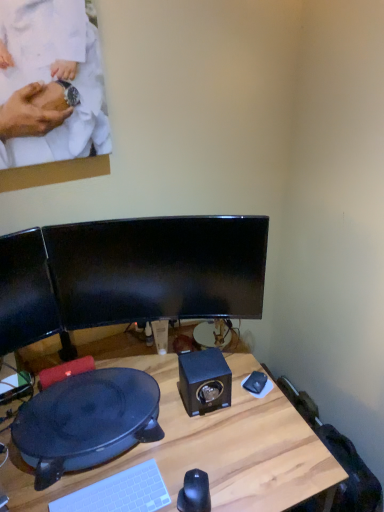
This screenshot has width=384, height=512. What do you see at coordinates (194, 492) in the screenshot? I see `black glossy mouse at lower center` at bounding box center [194, 492].

The width and height of the screenshot is (384, 512). What do you see at coordinates (206, 448) in the screenshot?
I see `wooden desk at center` at bounding box center [206, 448].

At what (x,y) coordinates should I click in order to perform the action: click on black glossy mouse at lower center. Please return your answer as a coordinate pair (x, y). Image resolution: width=384 pixels, height=512 pixels. Looking at the image, I should click on (194, 492).

In the scene shown: From the image's perspective, is black glossy mouse at lower center below white plastic keyboard at lower center?

Actually, black glossy mouse at lower center appears above white plastic keyboard at lower center in the image.

Locate an element on the screen. The width and height of the screenshot is (384, 512). mouse located behind the white plastic keyboard at lower center is located at coordinates (194, 492).

Is black glossy mouse at lower center outside of white plastic keyboard at lower center?

Yes.

Can you confirm if black glossy mouse at lower center is taller than black matte speaker at center?

No, black glossy mouse at lower center is not taller than black matte speaker at center.

How different are the orientations of black glossy mouse at lower center and black matte speaker at center in degrees?

They differ by 15.7 degrees in their facing directions.

Based on the photo, can you confirm if black glossy mouse at lower center is positioned to the left of black matte speaker at center?

Yes.

Locate an element on the screen. mouse located underneath the black matte speaker at center (from a real-world perspective) is located at coordinates (194, 492).

Does wooden desk at center have a lesser width compared to black glossy monitor at center?

In fact, wooden desk at center might be wider than black glossy monitor at center.

In the scene shown: Is wooden desk at center inside the boundaries of black glossy monitor at center, or outside?

wooden desk at center is not inside black glossy monitor at center, it's outside.

Is black matte speaker at center turned away from wooden desk at center?

black matte speaker at center does not have its back to wooden desk at center.

Which is correct: black matte speaker at center is inside wooden desk at center, or outside of it?

black matte speaker at center is outside wooden desk at center.

Find the location of `desk below the black matte speaker at center (from the image's perspective)`. desk below the black matte speaker at center (from the image's perspective) is located at coordinates (206, 448).

Looking at this image, is black glossy monitor at center oriented towards black glossy mouse at lower center?

No, black glossy monitor at center does not turn towards black glossy mouse at lower center.

Is black glossy monitor at center at the right side of black glossy mouse at lower center?

Incorrect, black glossy monitor at center is not on the right side of black glossy mouse at lower center.

Which of these two, black glossy monitor at center or black glossy mouse at lower center, stands taller?

black glossy monitor at center.

How many degrees apart are the facing directions of black glossy monitor at center and black glossy mouse at lower center?

The angular difference between black glossy monitor at center and black glossy mouse at lower center is 2.86 degrees.

Considering the sizes of objects black matte speaker at center and black glossy monitor at center in the image provided, who is smaller, black matte speaker at center or black glossy monitor at center?

black matte speaker at center.

Locate an element on the screen. speaker on the right of black glossy monitor at center is located at coordinates (204, 381).

Considering the points (193, 391) and (81, 247), which point is behind, point (193, 391) or point (81, 247)?

The point (193, 391) is farther.

From a real-world perspective, is black matte speaker at center physically located above or below black glossy monitor at center?

From a real-world perspective, black matte speaker at center is physically below black glossy monitor at center.

From a real-world perspective, who is located higher, wooden desk at center or white plastic keyboard at lower center?

From a 3D spatial view, white plastic keyboard at lower center is above.

From the image's perspective, is wooden desk at center located above or below white plastic keyboard at lower center?

Based on their image positions, wooden desk at center is located beneath white plastic keyboard at lower center.

Is wooden desk at center directly adjacent to white plastic keyboard at lower center?

No, wooden desk at center is not touching white plastic keyboard at lower center.

Considering the relative sizes of wooden desk at center and white plastic keyboard at lower center in the image provided, is wooden desk at center thinner than white plastic keyboard at lower center?

No.

The height and width of the screenshot is (512, 384). I want to click on mouse on the right of white plastic keyboard at lower center, so click(x=194, y=492).

Locate an element on the screen. The height and width of the screenshot is (512, 384). mouse below the black matte speaker at center (from the image's perspective) is located at coordinates (194, 492).

Consider the image. Looking at the image, which one is located closer to wooden desk at center, black matte speaker at center or black glossy mouse at lower center?

The object closer to wooden desk at center is black matte speaker at center.

Based on their spatial positions, is black plastic wok at lower left or black matte speaker at center closer to white plastic keyboard at lower center?

black plastic wok at lower left is positioned closer to the anchor white plastic keyboard at lower center.

Based on their spatial positions, is black glossy mouse at lower center or black glossy monitor at center closer to white plastic keyboard at lower center?

black glossy mouse at lower center is positioned closer to the anchor white plastic keyboard at lower center.

Looking at the image, which one is located further to black glossy mouse at lower center, black glossy monitor at center or black plastic wok at lower left?

Based on the image, black glossy monitor at center appears to be further to black glossy mouse at lower center.

From the image, which object appears to be farther from black glossy mouse at lower center, black matte speaker at center or black plastic wok at lower left?

Based on the image, black plastic wok at lower left appears to be further to black glossy mouse at lower center.

Considering their positions, is black matte speaker at center positioned closer to wooden desk at center than white plastic keyboard at lower center?

The object closer to wooden desk at center is black matte speaker at center.

Based on their spatial positions, is wooden desk at center or black glossy monitor at center further from white plastic keyboard at lower center?

Among the two, black glossy monitor at center is located further to white plastic keyboard at lower center.

Which object lies nearer to the anchor point black glossy mouse at lower center, white plastic keyboard at lower center or black plastic wok at lower left?

The object closer to black glossy mouse at lower center is white plastic keyboard at lower center.

Find the location of a particular element. Image resolution: width=384 pixels, height=512 pixels. mouse between wooden desk at center and black matte speaker at center from front to back is located at coordinates (194, 492).

The width and height of the screenshot is (384, 512). Find the location of `speaker between black glossy monitor at center and black plastic wok at lower left in the up-down direction`. speaker between black glossy monitor at center and black plastic wok at lower left in the up-down direction is located at coordinates (204, 381).

Where is `mouse between black glossy monitor at center and wooden desk at center in the up-down direction`? This screenshot has height=512, width=384. mouse between black glossy monitor at center and wooden desk at center in the up-down direction is located at coordinates (194, 492).

The image size is (384, 512). In order to click on computer keyboard that lies between black plastic wok at lower left and wooden desk at center from top to bottom in this screenshot , I will do `click(119, 493)`.